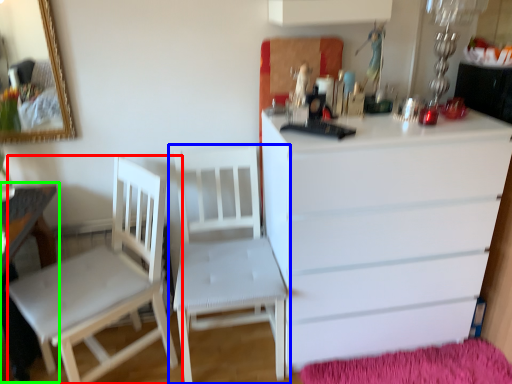
Question: Based on their relative distances, which object is farther from chair (highlighted by a red box)? Choose from chair (highlighted by a blue box) and table (highlighted by a green box).

Choices:
 (A) chair
 (B) table

Answer: (A)